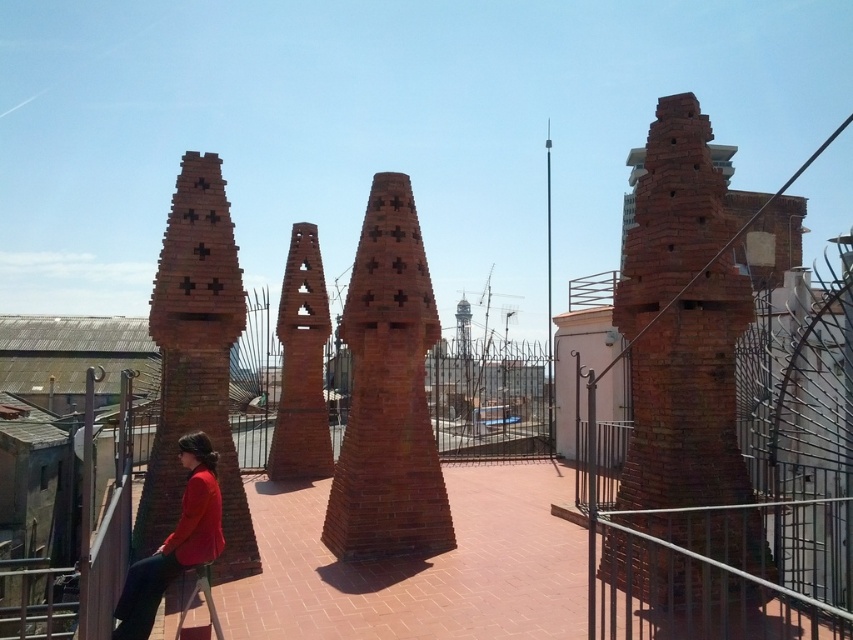
This screenshot has width=853, height=640. What do you see at coordinates (685, 349) in the screenshot?
I see `red brick chimney at right` at bounding box center [685, 349].

Is red brick chimney at right above red brick chimney at center?

Correct, red brick chimney at right is located above red brick chimney at center.

Which is in front, point (703, 538) or point (315, 404)?

Point (703, 538) is more forward.

Locate an element on the screen. red brick chimney at right is located at coordinates (685, 349).

Is point (376, 438) positioned before point (328, 310)?

Yes, point (376, 438) is closer to viewer.

Which is below, brick sculpture at center or red brick chimney at center?

brick sculpture at center is below.

This screenshot has height=640, width=853. Identify the location of brick sculpture at center. (387, 392).

Locate an element on the screen. Image resolution: width=853 pixels, height=640 pixels. brick sculpture at center is located at coordinates (387, 392).

In the scene shown: Is red brick chimney at left to the left of matte red jacket at lower left from the viewer's perspective?

Correct, you'll find red brick chimney at left to the left of matte red jacket at lower left.

Is point (187, 374) positioned behind point (190, 452)?

Yes.

Does point (213, 243) come farther from viewer compared to point (202, 484)?

Yes.

Locate an element on the screen. red brick chimney at left is located at coordinates [x=196, y=362].